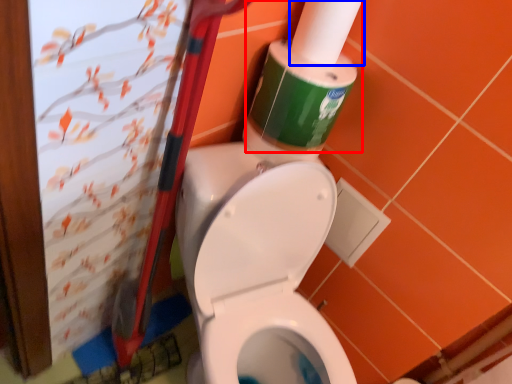
Question: Which object appears farthest to the camera in this image, cleaning product (highlighted by a red box) or toilet paper (highlighted by a blue box)?

Choices:
 (A) cleaning product
 (B) toilet paper

Answer: (A)